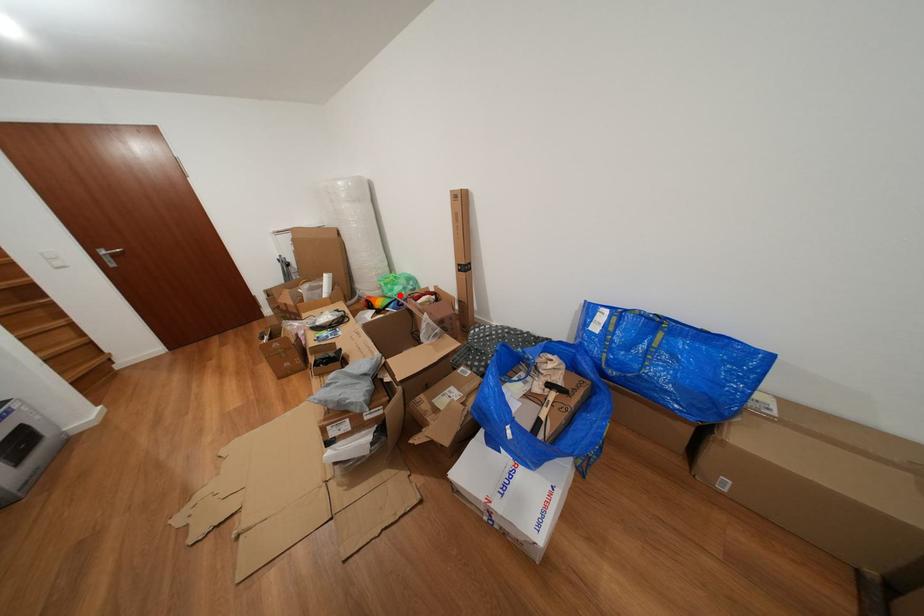
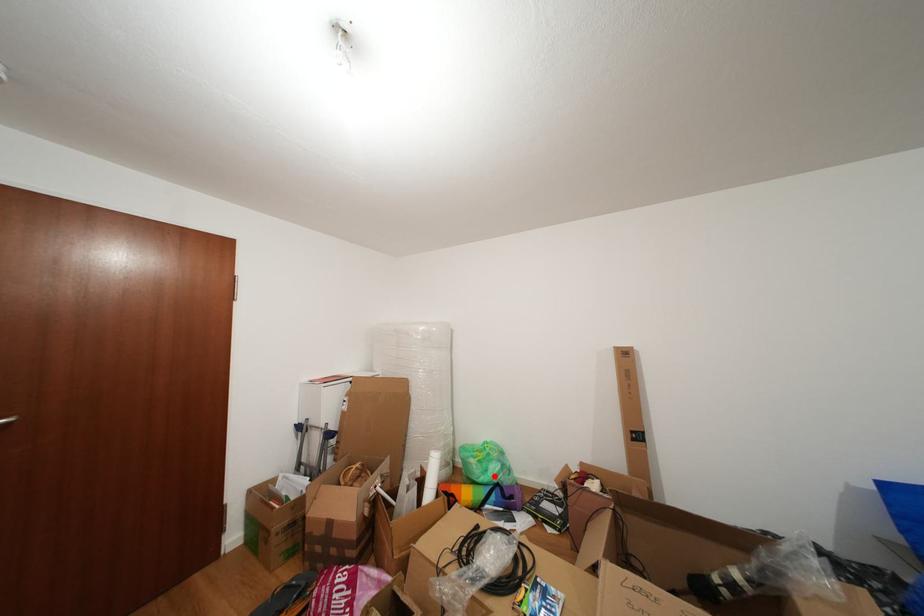
I am providing you with two images of the same scene from different viewpoints. A red point is marked on the first image and another point is marked on the second image. Does the point marked in image1 correspond to the same location as the one in image2?

Yes